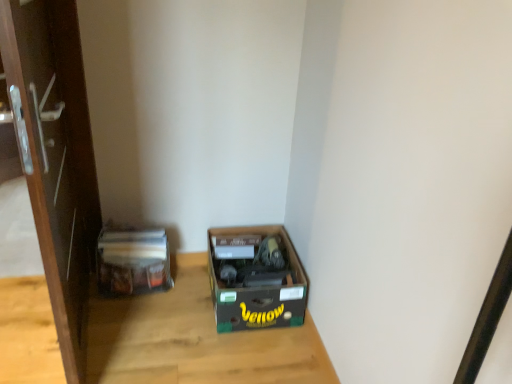
This screenshot has height=384, width=512. In order to click on vacant space underneath brown glossy door at left (from a real-world perspective) in this screenshot , I will do `click(89, 331)`.